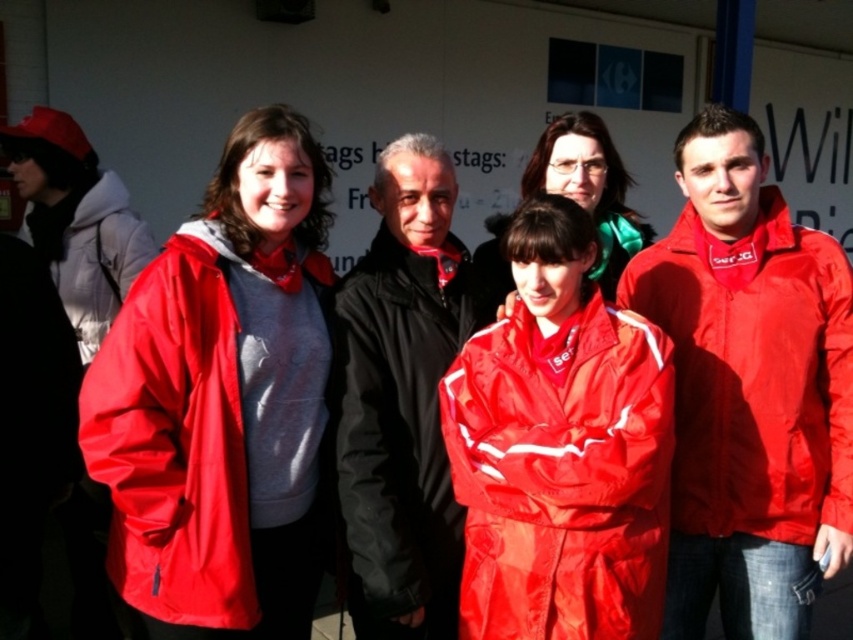
Question: Does matte red jacket at center have a lesser width compared to matte red jacket at left?

Choices:
 (A) yes
 (B) no

Answer: (B)

Question: Does matte nylon jacket at left have a smaller size compared to matte red jacket at left?

Choices:
 (A) yes
 (B) no

Answer: (A)

Question: Which object is farther from the camera taking this photo?

Choices:
 (A) matte red jacket at center
 (B) matte red jacket at right
 (C) shiny red jacket at center

Answer: (A)

Question: Which point is farther from the camera taking this photo?

Choices:
 (A) (688, 518)
 (B) (556, 145)

Answer: (B)

Question: Which object is closer to the camera taking this photo?

Choices:
 (A) matte red jacket at center
 (B) shiny red jacket at center

Answer: (B)

Question: Does shiny red jacket at center have a larger size compared to matte red jacket at center?

Choices:
 (A) yes
 (B) no

Answer: (B)